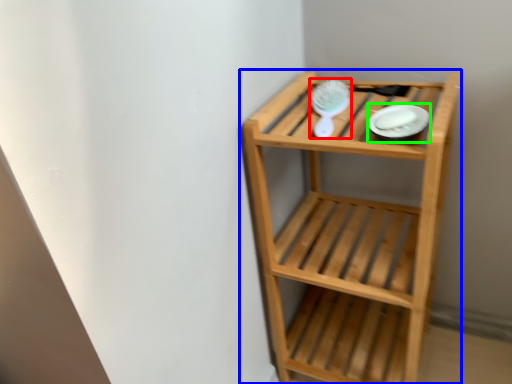
Question: Based on their relative distances, which object is farther from brush (highlighted by a red box)? Choose from shelf (highlighted by a blue box) and platter (highlighted by a green box).

Choices:
 (A) shelf
 (B) platter

Answer: (A)